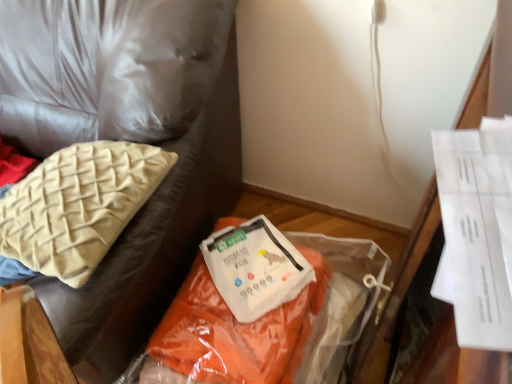
Locate an element on the screen. orange fabric at center is located at coordinates (243, 307).

Image resolution: width=512 pixels, height=384 pixels. Describe the element at coordinates (127, 140) in the screenshot. I see `orange fabric bag at lower right` at that location.

Image resolution: width=512 pixels, height=384 pixels. I want to click on beige woven cushion at upper left, so click(76, 208).

The height and width of the screenshot is (384, 512). What are the coordinates of `orange fabric at center` in the screenshot? It's located at (243, 307).

Who is shorter, white paper at center or beige woven cushion at upper left?

With less height is white paper at center.

Is point (289, 283) less distant than point (20, 188)?

No, (289, 283) is further to viewer.

Which is more to the left, white paper at center or beige woven cushion at upper left?

beige woven cushion at upper left is more to the left.

From a real-world perspective, is white paper at center on beige woven cushion at upper left?

Actually, white paper at center is physically below beige woven cushion at upper left in the real world.

Is white paper at center at the right side of orange fabric at center?

Incorrect, white paper at center is not on the right side of orange fabric at center.

How much distance is there between white paper at center and orange fabric at center?

white paper at center and orange fabric at center are 1.41 inches apart.

Locate an element on the screen. Image resolution: width=512 pixels, height=384 pixels. wrap above the orange fabric at center (from a real-world perspective) is located at coordinates (255, 268).

Is white paper at center shorter than orange fabric at center?

Indeed, white paper at center has a lesser height compared to orange fabric at center.

Does orange fabric at center have a smaller size compared to beige woven cushion at upper left?

No, orange fabric at center is not smaller than beige woven cushion at upper left.

Is orange fabric at center completely or partially outside of beige woven cushion at upper left?

orange fabric at center is positioned outside beige woven cushion at upper left.

Which is closer, (278, 375) or (276, 280)?

Point (278, 375).

How many degrees apart are the facing directions of orange fabric at center and white paper at center?

The angle between the facing direction of orange fabric at center and the facing direction of white paper at center is 41.2 degrees.

From the image's perspective, is orange fabric at center on top of white paper at center?

Incorrect, from the image's perspective, orange fabric at center is lower than white paper at center.

Is orange fabric at center not within white paper at center?

That's correct, orange fabric at center is outside of white paper at center.

Between orange fabric bag at lower right and white paper at center, which one has smaller width?

white paper at center is thinner.

Considering the positions of objects orange fabric bag at lower right and white paper at center in the image provided, who is more to the left, orange fabric bag at lower right or white paper at center?

Positioned to the left is orange fabric bag at lower right.

Based on the photo, from the image's perspective, which is above, orange fabric bag at lower right or white paper at center?

orange fabric bag at lower right appears higher in the image.

Considering the sizes of objects orange fabric bag at lower right and white paper at center in the image provided, who is taller, orange fabric bag at lower right or white paper at center?

orange fabric bag at lower right.

Considering the sizes of objects beige woven cushion at upper left and orange fabric bag at lower right in the image provided, who is thinner, beige woven cushion at upper left or orange fabric bag at lower right?

beige woven cushion at upper left.

Is there a large distance between beige woven cushion at upper left and orange fabric bag at lower right?

That's not correct — beige woven cushion at upper left is a little close to orange fabric bag at lower right.

From a real-world perspective, which object rests below the other?

In real-world perspective, orange fabric bag at lower right is lower.

How distant is beige woven cushion at upper left from orange fabric bag at lower right?

The distance of beige woven cushion at upper left from orange fabric bag at lower right is 6.64 inches.

You are a GUI agent. You are given a task and a screenshot of the screen. Output one action in this format:
    pyautogui.click(x=<x>, y=<y>)
    Task: Click on the wrap that is behind the beige woven cushion at upper left
    
    Given the screenshot: What is the action you would take?
    pyautogui.click(x=255, y=268)

Which of these two, beige woven cushion at upper left or white paper at center, is wider?

beige woven cushion at upper left is wider.

Are beige woven cushion at upper left and white paper at center far apart?

They are positioned close to each other.

This screenshot has width=512, height=384. What are the coordinates of `pillow on the left of white paper at center` in the screenshot? It's located at tap(76, 208).

Where is `wrap behind the orange fabric at center`? wrap behind the orange fabric at center is located at coordinates (255, 268).

When comparing their distances from orange fabric bag at lower right, does white paper at center or orange fabric at center seem further?

white paper at center.

Considering their positions, is orange fabric bag at lower right positioned closer to white paper at center than beige woven cushion at upper left?

Among the two, orange fabric bag at lower right is located nearer to white paper at center.

Based on their spatial positions, is orange fabric bag at lower right or white paper at center further from beige woven cushion at upper left?

The object further to beige woven cushion at upper left is white paper at center.

Based on their spatial positions, is white paper at center or orange fabric bag at lower right closer to beige woven cushion at upper left?

orange fabric bag at lower right lies closer to beige woven cushion at upper left than the other object.

Looking at the image, which one is located further to orange fabric bag at lower right, beige woven cushion at upper left or orange fabric at center?

Based on the image, orange fabric at center appears to be further to orange fabric bag at lower right.

Considering their positions, is orange fabric at center positioned closer to beige woven cushion at upper left than white paper at center?

Among the two, orange fabric at center is located nearer to beige woven cushion at upper left.

When comparing their distances from beige woven cushion at upper left, does orange fabric bag at lower right or orange fabric at center seem closer?

orange fabric bag at lower right lies closer to beige woven cushion at upper left than the other object.

Considering their positions, is orange fabric bag at lower right positioned closer to white paper at center than orange fabric at center?

orange fabric at center.

The image size is (512, 384). In order to click on pillow situated between orange fabric bag at lower right and orange fabric at center from left to right in this screenshot , I will do `click(76, 208)`.

You are a GUI agent. You are given a task and a screenshot of the screen. Output one action in this format:
    pyautogui.click(x=<x>, y=<y>)
    Task: Click on the pillow between orange fabric bag at lower right and white paper at center
    Image resolution: width=512 pixels, height=384 pixels.
    Given the screenshot: What is the action you would take?
    pyautogui.click(x=76, y=208)

Find the location of `wrap situated between beige woven cushion at upper left and orange fabric at center from left to right`. wrap situated between beige woven cushion at upper left and orange fabric at center from left to right is located at coordinates (255, 268).

Identify the location of wrap situated between orange fabric bag at lower right and orange fabric at center from left to right. This screenshot has width=512, height=384. (255, 268).